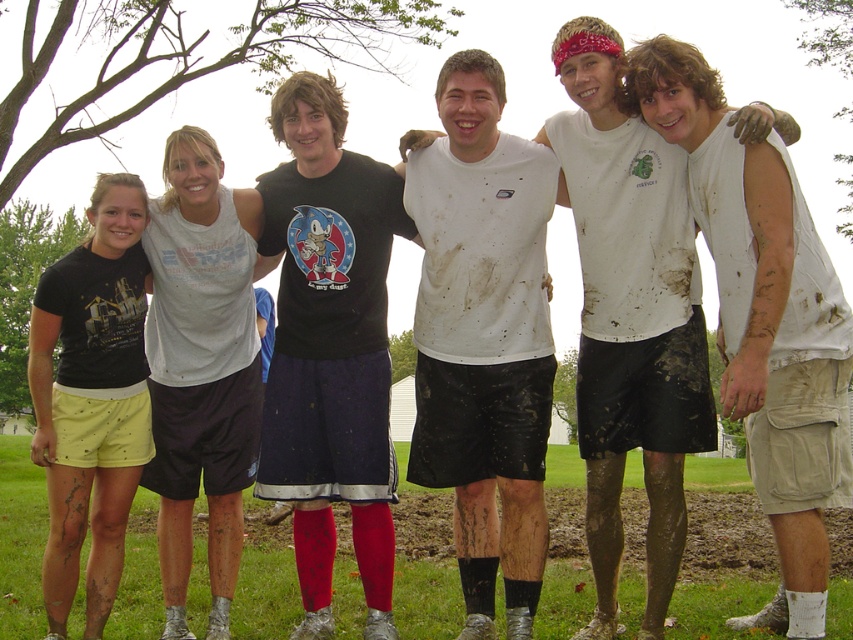
The height and width of the screenshot is (640, 853). What do you see at coordinates (483, 337) in the screenshot? I see `white matte tank top at center` at bounding box center [483, 337].

Between white matte tank top at center and white matte shirt at center, which one appears on the right side from the viewer's perspective?

white matte shirt at center

Between point (454, 188) and point (653, 442), which one is positioned in front?

Point (653, 442) is in front.

The width and height of the screenshot is (853, 640). I want to click on white matte tank top at center, so click(483, 337).

Does black t-shirt at center have a greater width compared to white sleeveless shirt at center?

Incorrect, black t-shirt at center's width does not surpass white sleeveless shirt at center's.

Which is above, black t-shirt at center or white sleeveless shirt at center?

Positioned higher is white sleeveless shirt at center.

At what (x,y) coordinates should I click in order to perform the action: click on black t-shirt at center. Please return your answer as a coordinate pair (x, y). The height and width of the screenshot is (640, 853). Looking at the image, I should click on (329, 348).

Is black t-shirt at center to the left of white matte shirt at center from the viewer's perspective?

Correct, you'll find black t-shirt at center to the left of white matte shirt at center.

Between point (312, 356) and point (627, 369), which one is positioned behind?

The point (312, 356) is behind.

This screenshot has width=853, height=640. Find the location of `black t-shirt at center`. black t-shirt at center is located at coordinates (329, 348).